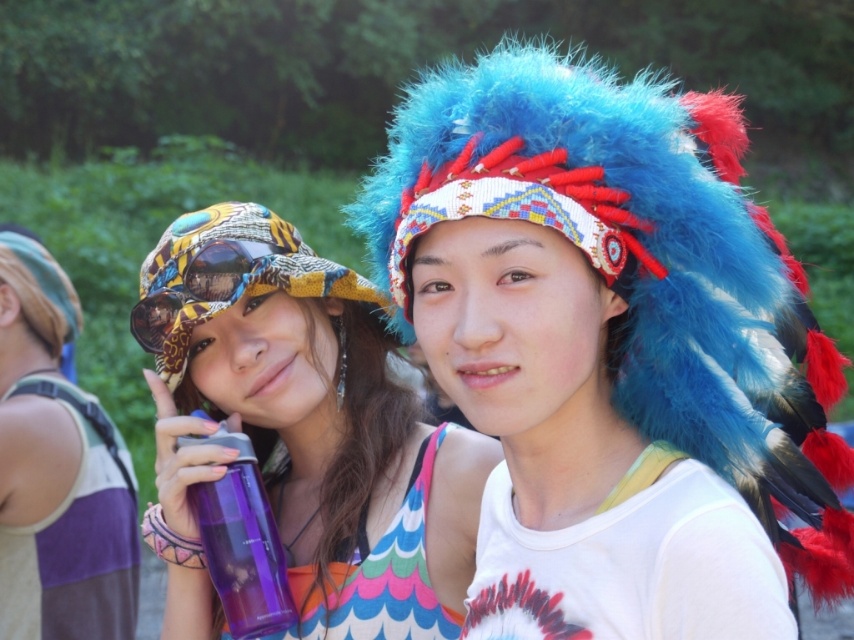
You are a photographer trying to capture a closeup shot of the fuzzy blue headdress at center and the purple plastic water bottle at center. Which object should you focus on first to ensure it appears sharp in your photo?

The fuzzy blue headdress at center is closer to the viewer than the purple plastic water bottle at center, so you should focus on the fuzzy blue headdress at center first to ensure it appears sharp in your photo.

You are standing in the park scene with two people. You want to take a photo of the point at (153, 300) and the point at (212, 227). Which point should be closer to the camera in your photo?

The point at (153, 300) is further to the camera than the point at (212, 227), so the point at (212, 227) will be closer to the camera in your photo.